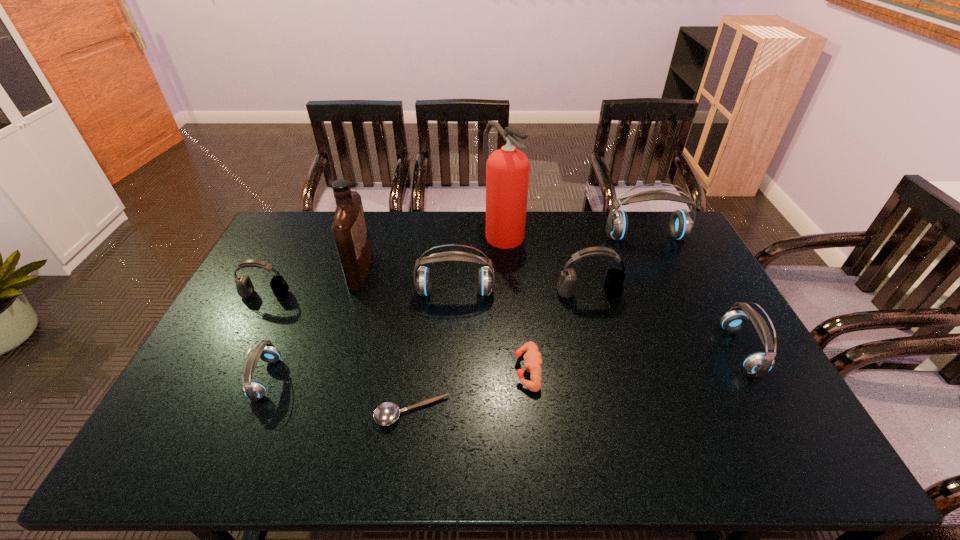
I want to click on vacant point located between the fourth headset from left to right and the liquor, so click(x=474, y=282).

Where is `free space between the second smallest blue headset and the third blue headset from right to left`? The image size is (960, 540). free space between the second smallest blue headset and the third blue headset from right to left is located at coordinates (598, 321).

This screenshot has width=960, height=540. Identify the location of free space that is in between the bigger black headset and the third biggest blue headset. (664, 322).

Locate an element on the screen. The image size is (960, 540). object that is the fifth closest to the liquor is located at coordinates (387, 413).

Choose which object is the seventh nearest neighbor to the left black headset. Please provide its 2D coordinates. Your answer should be formatted as a tuple, i.e. [(x, y)], where the tuple contains the x and y coordinates of a point satisfying the conditions above.

[(613, 286)]

Locate an element on the screen. headset identified as the fourth closest to the gray ladle is located at coordinates (245, 288).

The width and height of the screenshot is (960, 540). In order to click on the fifth closest headset to the third object from right to left in this screenshot , I will do `click(245, 288)`.

Select which blue headset appears as the closest to the second smallest blue headset. Please provide its 2D coordinates. Your answer should be formatted as a tuple, i.e. [(x, y)], where the tuple contains the x and y coordinates of a point satisfying the conditions above.

[(681, 223)]

Find the location of `blue headset that can be found as the closest to the second shortest object`. blue headset that can be found as the closest to the second shortest object is located at coordinates (423, 279).

Where is `free space that satisfies the following two spatial constraints: 1. on the headband of the shortest object; 2. on the left side of the leftmost headset`? free space that satisfies the following two spatial constraints: 1. on the headband of the shortest object; 2. on the left side of the leftmost headset is located at coordinates (204, 412).